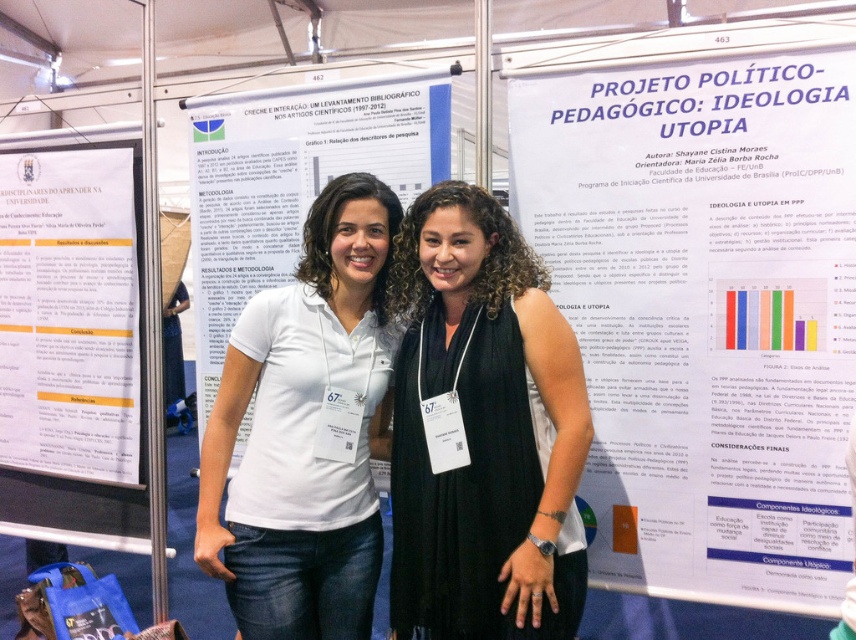
Question: Among these points, which one is farthest from the camera?

Choices:
 (A) (428, 176)
 (B) (660, 285)
 (C) (432, 244)
 (D) (34, 218)

Answer: (D)

Question: Does white paper at upper center have a smaller size compared to white paper at center?

Choices:
 (A) no
 (B) yes

Answer: (B)

Question: Does white cotton polo shirt at center appear over white paper at center?

Choices:
 (A) no
 (B) yes

Answer: (A)

Question: Which of the following is the farthest from the observer?

Choices:
 (A) (215, 470)
 (B) (230, 465)
 (C) (592, 288)
 (D) (563, 403)

Answer: (B)

Question: Considering the real-world distances, which object is farthest from the white paper poster at left?

Choices:
 (A) white paper at center
 (B) black sleeveless dress at center

Answer: (B)

Question: Can you confirm if white paper at upper center is wider than white paper at center?

Choices:
 (A) yes
 (B) no

Answer: (B)